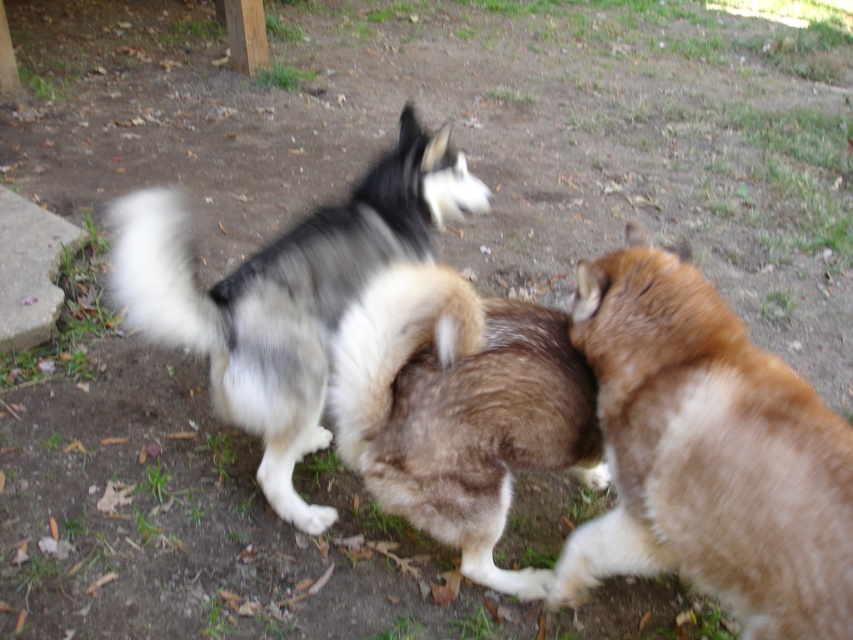
Question: Which of the following is the farthest from the observer?

Choices:
 (A) (750, 456)
 (B) (219, 291)
 (C) (438, 483)

Answer: (B)

Question: Which object is positioned farthest from the brown fluffy dog at right?

Choices:
 (A) black and white fur dog at center
 (B) fuzzy brown dog at center

Answer: (A)

Question: Among these objects, which one is farthest from the camera?

Choices:
 (A) brown fluffy dog at right
 (B) fuzzy brown dog at center
 (C) black and white fur dog at center

Answer: (C)

Question: Considering the relative positions of brown fluffy dog at right and black and white fur dog at center in the image provided, where is brown fluffy dog at right located with respect to black and white fur dog at center?

Choices:
 (A) above
 (B) below

Answer: (B)

Question: Does brown fluffy dog at right have a greater width compared to fuzzy brown dog at center?

Choices:
 (A) no
 (B) yes

Answer: (A)

Question: Does brown fluffy dog at right appear on the left side of fuzzy brown dog at center?

Choices:
 (A) yes
 (B) no

Answer: (B)